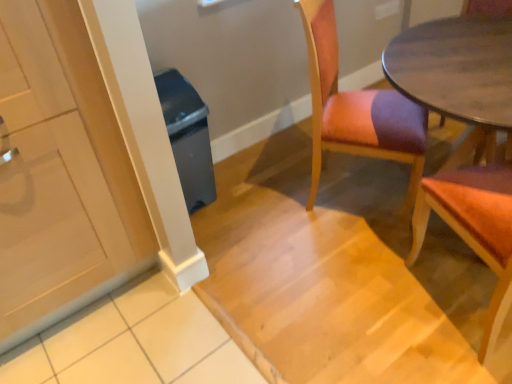
Image resolution: width=512 pixels, height=384 pixels. I want to click on free space between wooden chair at right, arranged as the 2th chair when viewed from the left, and white glossy cabinet at left, so click(x=263, y=299).